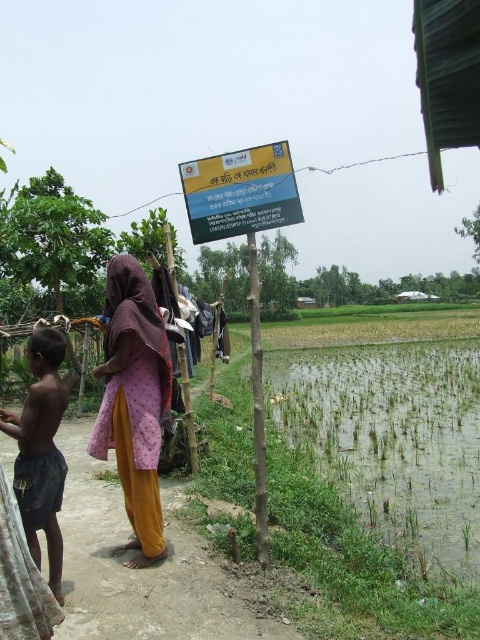
Is purple printed dress at left taller than dark gray shorts at lower left?

Yes, purple printed dress at left is taller than dark gray shorts at lower left.

Is purple printed dress at left wider than dark gray shorts at lower left?

Yes, purple printed dress at left is wider than dark gray shorts at lower left.

I want to click on purple printed dress at left, so click(x=133, y=401).

Can you confirm if green grassy flood at lower right is bigger than dark gray shorts at lower left?

Yes.

Does green grassy flood at lower right have a lesser width compared to dark gray shorts at lower left?

No, green grassy flood at lower right is not thinner than dark gray shorts at lower left.

Is point (441, 435) closer to viewer compared to point (38, 397)?

No, it is not.

Identify the location of green grassy flood at lower right. This screenshot has width=480, height=640. (393, 436).

Can you confirm if green grassy flood at lower right is positioned to the left of pink fabric at center?

Incorrect, green grassy flood at lower right is not on the left side of pink fabric at center.

This screenshot has height=640, width=480. Describe the element at coordinates (393, 436) in the screenshot. I see `green grassy flood at lower right` at that location.

At what (x,y) coordinates should I click in order to perform the action: click on green grassy flood at lower right. Please return your answer as a coordinate pair (x, y). Image resolution: width=480 pixels, height=640 pixels. Looking at the image, I should click on coord(393,436).